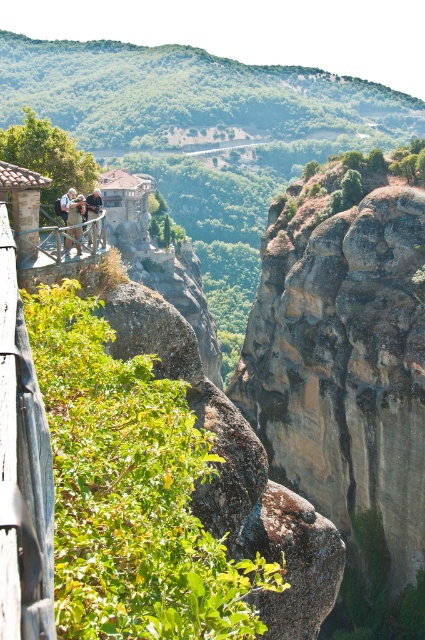
Question: Estimate the real-world distances between objects in this image. Which object is closer to the wooden at left?

Choices:
 (A) brown rough rock at center
 (B) light brown leather jacket at upper center
 (C) green leafy hillside at upper center

Answer: (B)

Question: Does light brown leather jacket at upper center appear over light brown wooden railing at upper left?

Choices:
 (A) no
 (B) yes

Answer: (A)

Question: Does light brown leather jacket at upper center have a greater width compared to light brown wooden railing at upper left?

Choices:
 (A) yes
 (B) no

Answer: (A)

Question: Which point appears farthest from the camera in this image?

Choices:
 (A) (70, 237)
 (B) (328, 627)
 (C) (17, 83)

Answer: (C)

Question: Is brown rough rock at center to the right of green leafy hillside at upper center from the viewer's perspective?

Choices:
 (A) yes
 (B) no

Answer: (A)

Question: Which object is closer to the camera taking this photo?

Choices:
 (A) brown rough rock at center
 (B) wooden at left
 (C) light brown wooden railing at upper left

Answer: (A)